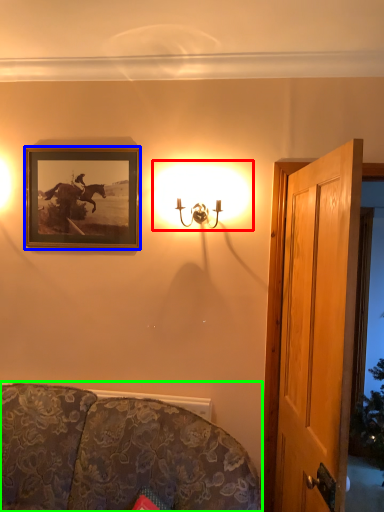
Question: Which is nearer to the lamp (highlighted by a red box)? picture frame (highlighted by a blue box) or studio couch (highlighted by a green box).

Choices:
 (A) picture frame
 (B) studio couch

Answer: (A)